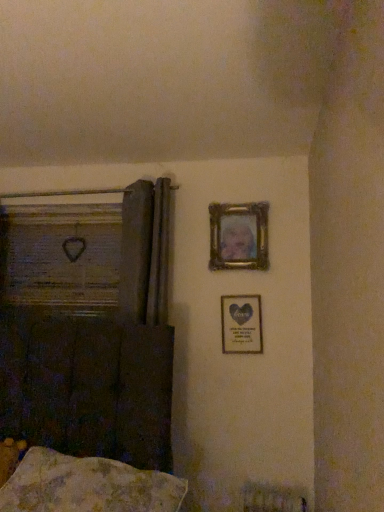
Question: Does wooden frame at left have a greater height compared to gold metallic picture frame at upper center, positioned as the second picture frame in bottom-to-top order?

Choices:
 (A) yes
 (B) no

Answer: (A)

Question: Is gold metallic picture frame at upper center, positioned as the second picture frame in bottom-to-top order, a part of wooden frame at left?

Choices:
 (A) yes
 (B) no

Answer: (B)

Question: Is wooden frame at left at the left side of gold metallic picture frame at upper center, positioned as the second picture frame in bottom-to-top order?

Choices:
 (A) no
 (B) yes

Answer: (B)

Question: Is wooden frame at left facing away from gold metallic picture frame at upper center, the 1th picture frame in the top-to-bottom sequence?

Choices:
 (A) yes
 (B) no

Answer: (B)

Question: From a real-world perspective, is wooden frame at left over gold metallic picture frame at upper center, positioned as the second picture frame in bottom-to-top order?

Choices:
 (A) yes
 (B) no

Answer: (B)

Question: Considering the relative positions of wooden frame at left and gold metallic picture frame at upper center, the 1th picture frame in the top-to-bottom sequence, in the image provided, is wooden frame at left in front of gold metallic picture frame at upper center, the 1th picture frame in the top-to-bottom sequence,?

Choices:
 (A) no
 (B) yes

Answer: (A)

Question: Are wooden frame at left and metallic gold picture frame at center-right, the second picture frame positioned from the top, making contact?

Choices:
 (A) yes
 (B) no

Answer: (B)

Question: Would you say wooden frame at left is outside metallic gold picture frame at center-right, which is the 1th picture frame in bottom-to-top order?

Choices:
 (A) yes
 (B) no

Answer: (A)

Question: Can you confirm if wooden frame at left is bigger than metallic gold picture frame at center-right, the second picture frame positioned from the top?

Choices:
 (A) yes
 (B) no

Answer: (A)

Question: Is wooden frame at left aimed at metallic gold picture frame at center-right, which is the 1th picture frame in bottom-to-top order?

Choices:
 (A) yes
 (B) no

Answer: (B)

Question: Is wooden frame at left taller than metallic gold picture frame at center-right, the second picture frame positioned from the top?

Choices:
 (A) yes
 (B) no

Answer: (A)

Question: Is wooden frame at left looking in the opposite direction of metallic gold picture frame at center-right, the second picture frame positioned from the top?

Choices:
 (A) yes
 (B) no

Answer: (B)

Question: Considering the relative sizes of wooden frame at left and fluffy beige pillow at lower left in the image provided, is wooden frame at left wider than fluffy beige pillow at lower left?

Choices:
 (A) no
 (B) yes

Answer: (A)